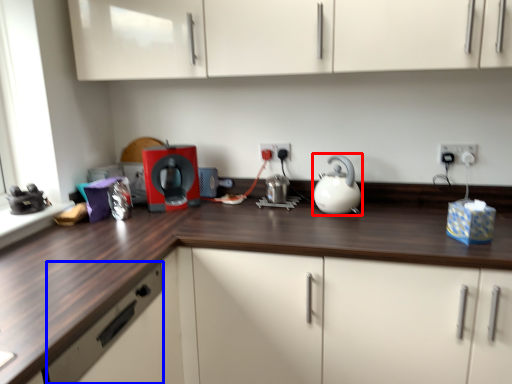
Question: Which of the following is the farthest to the observer, kitchen appliance (highlighted by a red box) or drawer (highlighted by a blue box)?

Choices:
 (A) kitchen appliance
 (B) drawer

Answer: (A)